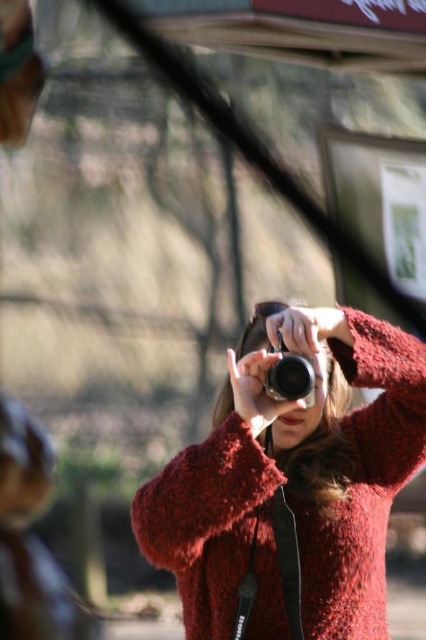
From the picture: Which is above, fuzzy red sweater at center or matte black camera at center?

Positioned higher is matte black camera at center.

Between point (259, 480) and point (311, 376), which one is positioned behind?

The point (311, 376) is more distant.

Identify the location of fuzzy red sweater at center. This screenshot has width=426, height=640. (293, 481).